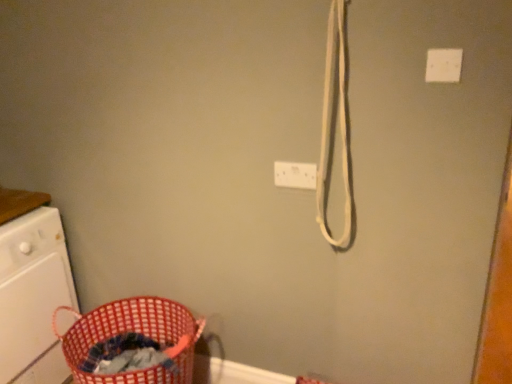
Question: Is red woven laundry basket at lower left inside white plastic washing machine at left?

Choices:
 (A) yes
 (B) no

Answer: (B)

Question: Is white plastic washing machine at left to the right of red woven laundry basket at lower left from the viewer's perspective?

Choices:
 (A) no
 (B) yes

Answer: (A)

Question: Would you say white plastic washing machine at left is outside red woven laundry basket at lower left?

Choices:
 (A) yes
 (B) no

Answer: (A)

Question: From the image's perspective, is white plastic washing machine at left beneath red woven laundry basket at lower left?

Choices:
 (A) yes
 (B) no

Answer: (B)

Question: Can you confirm if white plastic washing machine at left is bigger than red woven laundry basket at lower left?

Choices:
 (A) yes
 (B) no

Answer: (A)

Question: From a real-world perspective, is white plastic washing machine at left positioned above or below white plastic light switch at upper right?

Choices:
 (A) above
 (B) below

Answer: (B)

Question: Is white plastic washing machine at left inside or outside of white plastic light switch at upper right?

Choices:
 (A) inside
 (B) outside

Answer: (B)

Question: Is white plastic washing machine at left to the left or to the right of white plastic light switch at upper right in the image?

Choices:
 (A) right
 (B) left

Answer: (B)

Question: From their relative heights in the image, would you say white plastic washing machine at left is taller or shorter than white plastic light switch at upper right?

Choices:
 (A) short
 (B) tall

Answer: (B)

Question: Visually, is white plastic electric outlet at upper center positioned to the left or to the right of red woven laundry basket at lower left?

Choices:
 (A) right
 (B) left

Answer: (A)

Question: Is white plastic electric outlet at upper center situated inside red woven laundry basket at lower left or outside?

Choices:
 (A) inside
 (B) outside

Answer: (B)

Question: From their relative heights in the image, would you say white plastic electric outlet at upper center is taller or shorter than red woven laundry basket at lower left?

Choices:
 (A) short
 (B) tall

Answer: (A)

Question: From a real-world perspective, is white plastic electric outlet at upper center above or below red woven laundry basket at lower left?

Choices:
 (A) below
 (B) above

Answer: (B)

Question: Is point [x=305, y=162] closer or farther from the camera than point [x=425, y=77]?

Choices:
 (A) closer
 (B) farther

Answer: (B)

Question: Considering the positions of white plastic electric outlet at upper center and white plastic light switch at upper right in the image, is white plastic electric outlet at upper center taller or shorter than white plastic light switch at upper right?

Choices:
 (A) short
 (B) tall

Answer: (B)